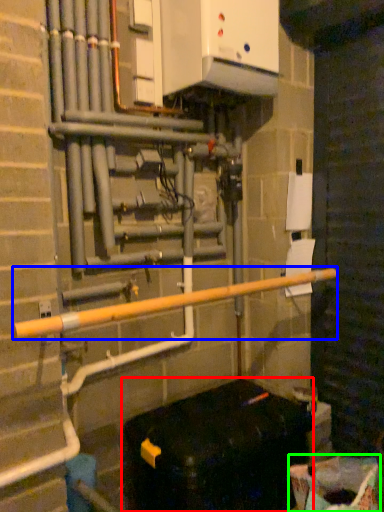
Question: Estimate the real-world distances between objects in this image. Which object is closer to furniture (highlighted by a red box), rail (highlighted by a blue box) or recycling bin (highlighted by a green box)?

Choices:
 (A) rail
 (B) recycling bin

Answer: (B)